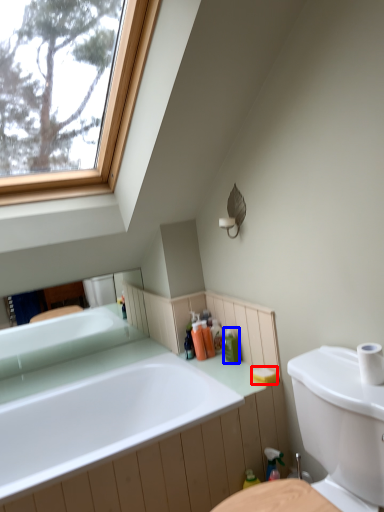
Question: Which of the following is the closest to the observer, soap (highlighted by a red box) or toiletry (highlighted by a blue box)?

Choices:
 (A) soap
 (B) toiletry

Answer: (A)